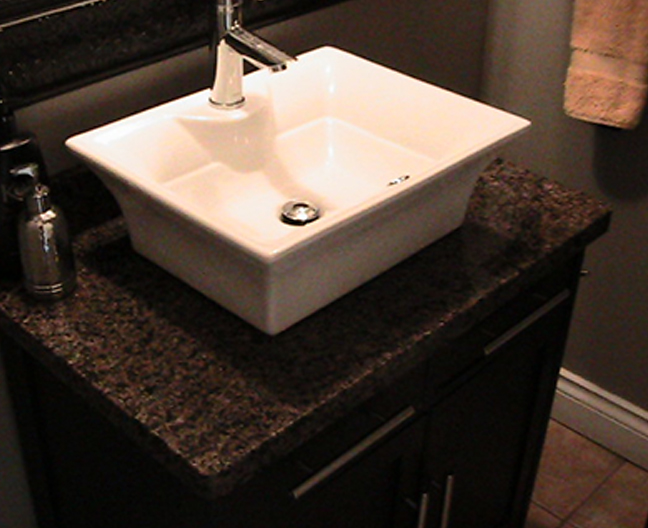
Where is `faucet`? This screenshot has height=528, width=648. faucet is located at coordinates (246, 46).